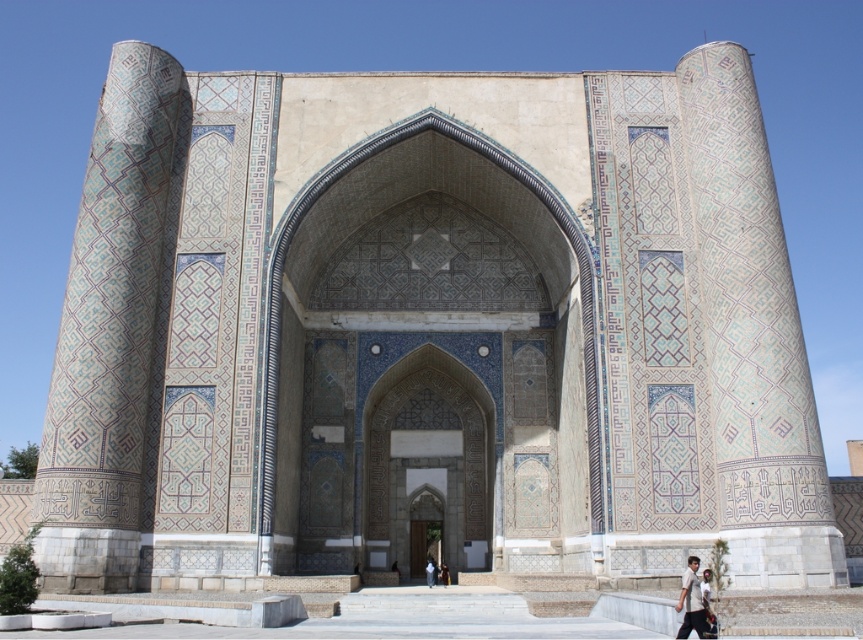
Question: Does blue mosaic pillar at left have a larger size compared to light brown fabric shirt at lower right?

Choices:
 (A) yes
 (B) no

Answer: (A)

Question: Which object appears farthest from the camera in this image?

Choices:
 (A) blue mosaic pillar at left
 (B) light brown fabric shirt at lower right

Answer: (A)

Question: Is the position of blue mosaic pillar at left more distant than that of light brown fabric shirt at lower right?

Choices:
 (A) yes
 (B) no

Answer: (A)

Question: Is blue mosaic pillar at left closer to camera compared to light brown fabric shirt at lower right?

Choices:
 (A) no
 (B) yes

Answer: (A)

Question: Which of the following is the closest to the observer?

Choices:
 (A) (690, 557)
 (B) (54, 570)

Answer: (B)